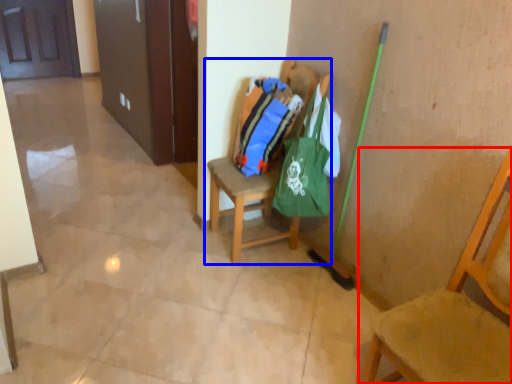
Question: Which object appears farthest to the camera in this image, chair (highlighted by a red box) or chair (highlighted by a blue box)?

Choices:
 (A) chair
 (B) chair

Answer: (B)